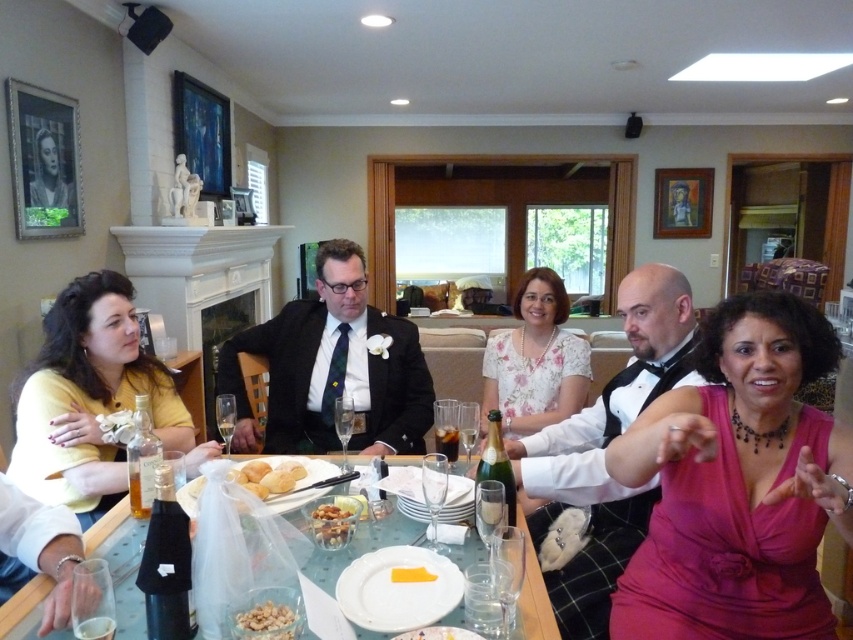
Does pink satin dress at center have a greater height compared to matte black suit at center?

Answer: No, pink satin dress at center is not taller than matte black suit at center.

Identify the location of pink satin dress at center. The image size is (853, 640). (738, 484).

Identify the location of pink satin dress at center. The height and width of the screenshot is (640, 853). (738, 484).

Is matte black suit at center taller than white matte plate at center?

Yes, matte black suit at center is taller than white matte plate at center.

Between point (306, 424) and point (363, 563), which one is positioned behind?

The point (306, 424) is more distant.

In order to click on matte black suit at center in this screenshot , I will do `click(332, 368)`.

Between matte black suit at center and yellow matte shirt at left, which one has more height?

With more height is matte black suit at center.

Can you confirm if matte black suit at center is positioned to the right of yellow matte shirt at left?

Indeed, matte black suit at center is positioned on the right side of yellow matte shirt at left.

Locate an element on the screen. This screenshot has width=853, height=640. matte black suit at center is located at coordinates (332, 368).